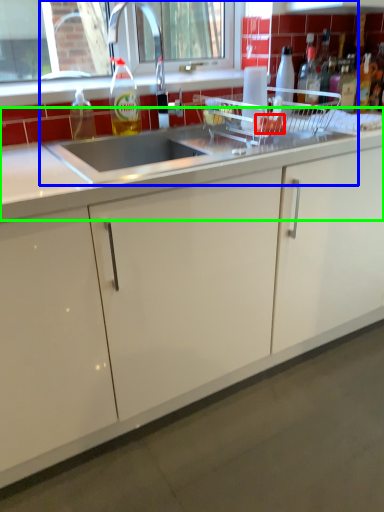
Question: Based on their relative distances, which object is nearer to food (highlighted by a red box)? Choose from sink (highlighted by a blue box) and countertop (highlighted by a green box).

Choices:
 (A) sink
 (B) countertop

Answer: (A)